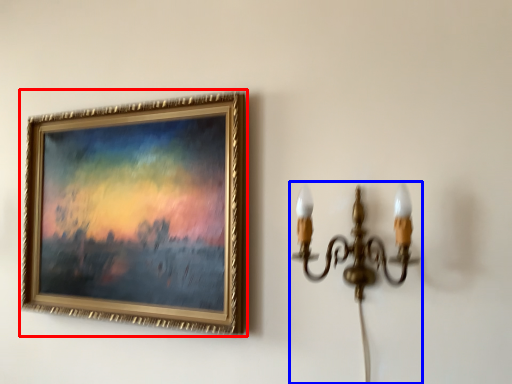
Question: Which object is further to the camera taking this photo, picture frame (highlighted by a red box) or lamp (highlighted by a blue box)?

Choices:
 (A) picture frame
 (B) lamp

Answer: (A)